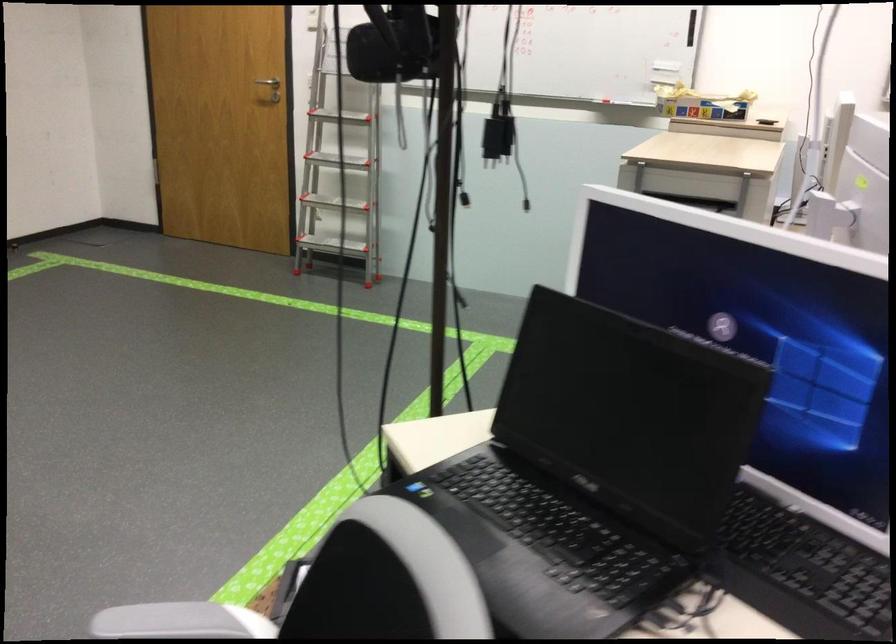
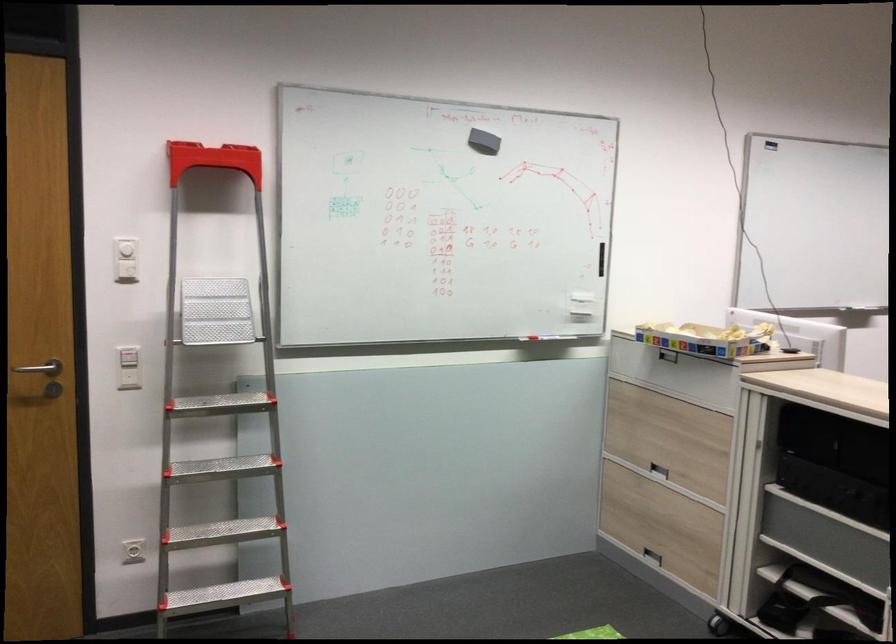
Where in the second image is the point corresponding to (x=346, y=95) from the first image?

(128, 377)